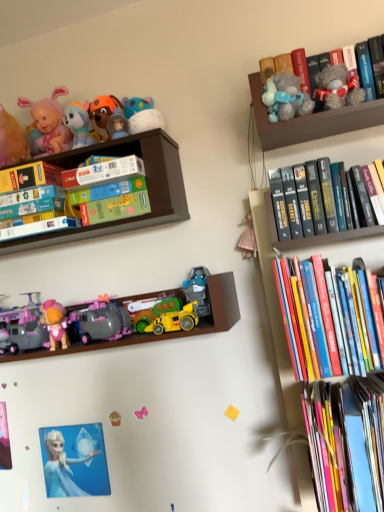
Image resolution: width=384 pixels, height=512 pixels. What are the coordinates of `hardcover book at right, the second book in the top-to-bottom sequence` in the screenshot? It's located at (330, 319).

What is the approximate width of hardcover book at right, the second book positioned from the bottom?

hardcover book at right, the second book positioned from the bottom, is 9.79 inches wide.

Image resolution: width=384 pixels, height=512 pixels. What do you see at coordinates (328, 212) in the screenshot?
I see `hardcover books at upper right, the 1th book from the top` at bounding box center [328, 212].

In order to face hardcover book at right, the third book positioned from the top, should I rotate leftwards or rightwards?

It's best to rotate right around 20.837 degrees.

Describe the element at coordinates (103, 173) in the screenshot. The width and height of the screenshot is (384, 512). I see `white matte paperback book at upper center, the 1th paperback book from the right` at that location.

Describe the element at coordinates (78, 124) in the screenshot. This screenshot has width=384, height=512. I see `plush toy at upper left, which is the third toy from top to bottom` at that location.

What do you see at coordinates (99, 321) in the screenshot? Image resolution: width=384 pixels, height=512 pixels. I see `matte plastic toy car at center, which appears as the fifth toy when viewed from the right` at bounding box center [99, 321].

I want to click on hardcover book at right, the second book positioned from the bottom, so click(x=330, y=319).

Does plush toy at upper left, which is counted as the fifth toy, starting from the bottom, have a lesser height compared to pink fabric bow at center, the second toy from the bottom?

In fact, plush toy at upper left, which is counted as the fifth toy, starting from the bottom, may be taller than pink fabric bow at center, the second toy from the bottom.

Is plush toy at upper left, placed as the second toy when sorted from left to right, facing towards pink fabric bow at center, the second toy from the bottom?

No, plush toy at upper left, placed as the second toy when sorted from left to right, is not turned towards pink fabric bow at center, the second toy from the bottom.

Which toy is the 1st one when counting from the front of the pink fabric bow at center, the 6th toy when ordered from top to bottom? Please provide its 2D coordinates.

[(78, 124)]

From a real-world perspective, is plush toy at upper left, placed as the second toy when sorted from left to right, above or below pink fabric bow at center, the 6th toy when ordered from top to bottom?

plush toy at upper left, placed as the second toy when sorted from left to right, is above pink fabric bow at center, the 6th toy when ordered from top to bottom.

Based on their positions, is fluffy gray teddy bear at upper right, the 1th toy viewed from the right, located to the left or right of pink fabric bow at center, the second toy from the bottom?

Based on their positions, fluffy gray teddy bear at upper right, the 1th toy viewed from the right, is located to the right of pink fabric bow at center, the second toy from the bottom.

From a real-world perspective, is fluffy gray teddy bear at upper right, the 7th toy positioned from the bottom, on pink fabric bow at center, the 5th toy from the left?

Yes, from a real-world perspective, fluffy gray teddy bear at upper right, the 7th toy positioned from the bottom, is above pink fabric bow at center, the 5th toy from the left.

Considering their positions, is fluffy gray teddy bear at upper right, which is counted as the seventh toy, starting from the left, located in front of or behind pink fabric bow at center, the 6th toy when ordered from top to bottom?

Visually, fluffy gray teddy bear at upper right, which is counted as the seventh toy, starting from the left, is located in front of pink fabric bow at center, the 6th toy when ordered from top to bottom.

In the scene shown: Is pink fabric bow at center, the 5th toy from the left, at the back of fluffy gray teddy bear at upper right, the 1th toy viewed from the right?

No, pink fabric bow at center, the 5th toy from the left, is not at the back of fluffy gray teddy bear at upper right, the 1th toy viewed from the right.

Considering the points (113, 421) and (101, 339), which point is in front, point (113, 421) or point (101, 339)?

The point (101, 339) is in front.

Locate an element on the screen. This screenshot has width=384, height=512. the 2nd toy above the pink fabric doll at lower left, arranged as the fourth toy when viewed from the left (from a real-world perspective) is located at coordinates (99, 321).

What's the angular difference between pink fabric doll at lower left, which appears as the fourth toy when viewed from the right, and matte plastic toy car at center, acting as the 4th toy starting from the bottom,'s facing directions?

0.116 degrees.

Considering the positions of objects pink fabric doll at lower left, which is the first toy in bottom-to-top order, and matte plastic toy car at center, which is the fourth toy from top to bottom, in the image provided, who is more to the right, pink fabric doll at lower left, which is the first toy in bottom-to-top order, or matte plastic toy car at center, which is the fourth toy from top to bottom,?

pink fabric doll at lower left, which is the first toy in bottom-to-top order.

Is white matte paperback book at upper center, placed as the second paperback book when sorted from left to right, to the left of yellow plastic toy car at center from the viewer's perspective?

Correct, you'll find white matte paperback book at upper center, placed as the second paperback book when sorted from left to right, to the left of yellow plastic toy car at center.

In terms of width, does white matte paperback book at upper center, the second paperback book in the bottom-to-top sequence, look wider or thinner when compared to yellow plastic toy car at center?

Considering their sizes, white matte paperback book at upper center, the second paperback book in the bottom-to-top sequence, looks broader than yellow plastic toy car at center.

Which of these two, white matte paperback book at upper center, the second paperback book in the bottom-to-top sequence, or yellow plastic toy car at center, stands shorter?

With less height is white matte paperback book at upper center, the second paperback book in the bottom-to-top sequence.

Image resolution: width=384 pixels, height=512 pixels. Find the location of `toy car below the white matte paperback book at upper center, the second paperback book in the bottom-to-top sequence (from a real-world perspective)`. toy car below the white matte paperback book at upper center, the second paperback book in the bottom-to-top sequence (from a real-world perspective) is located at coordinates (167, 317).

Are hardcover book at right, the second book in the top-to-bottom sequence, and hardcover book at right, which is the first book from bottom to top, making contact?

No, hardcover book at right, the second book in the top-to-bottom sequence, is not beside hardcover book at right, which is the first book from bottom to top.

Image resolution: width=384 pixels, height=512 pixels. I want to click on the 1st book above the hardcover book at right, the third book positioned from the top (from a real-world perspective), so click(x=330, y=319).

From a real-world perspective, is hardcover book at right, the second book positioned from the bottom, over hardcover book at right, which is the first book from bottom to top?

Yes, from a real-world perspective, hardcover book at right, the second book positioned from the bottom, is over hardcover book at right, which is the first book from bottom to top

Which of these two, hardcover book at right, which is the first book from bottom to top, or plush toy at upper left, which is the third toy from top to bottom, is thinner?

plush toy at upper left, which is the third toy from top to bottom, is thinner.

Does hardcover book at right, which is the first book from bottom to top, appear on the right side of plush toy at upper left, which is the sixth toy from right to left?

Yes.

Is hardcover book at right, the third book positioned from the top, oriented away from plush toy at upper left, which is the sixth toy from right to left?

hardcover book at right, the third book positioned from the top, does not have its back to plush toy at upper left, which is the sixth toy from right to left.

Considering the relative sizes of pink fabric doll at lower left, which is the first toy in bottom-to-top order, and yellow plastic toy car at center in the image provided, is pink fabric doll at lower left, which is the first toy in bottom-to-top order, bigger than yellow plastic toy car at center?

Actually, pink fabric doll at lower left, which is the first toy in bottom-to-top order, might be smaller than yellow plastic toy car at center.

From the image's perspective, which one is positioned lower, pink fabric doll at lower left, the 7th toy positioned from the top, or yellow plastic toy car at center?

pink fabric doll at lower left, the 7th toy positioned from the top.

Is pink fabric doll at lower left, arranged as the fourth toy when viewed from the left, not near yellow plastic toy car at center?

No, pink fabric doll at lower left, arranged as the fourth toy when viewed from the left, is not far from yellow plastic toy car at center.

From a real-world perspective, count 5th toys downward from the plush toy at upper left, which is the sixth toy from right to left, and point to it. Please provide its 2D coordinates.

[(141, 413)]

From the fluffy gray teddy bear at upper right, the 1th toy viewed from the right, count the 2nd toy to the left and point to it. Please provide its 2D coordinates.

[(141, 413)]

Looking at the image, which one is located further to hardcover book at right, the third book positioned from the top, matte purple plastic toy car at lower left, placed as the 1th toy when sorted from left to right, or pink fabric bow at center, the 5th toy from the left?

matte purple plastic toy car at lower left, placed as the 1th toy when sorted from left to right, lies further to hardcover book at right, the third book positioned from the top, than the other object.

From the image, which object appears to be nearer to hardcover book at right, the second book in the top-to-bottom sequence, matte plastic toy car at center, which appears as the fifth toy when viewed from the right, or hardcover book at left, which ranks as the first paperback book in bottom-to-top order?

Among the two, matte plastic toy car at center, which appears as the fifth toy when viewed from the right, is located nearer to hardcover book at right, the second book in the top-to-bottom sequence.

Looking at the image, which one is located closer to hardcover books at upper right, the 1th book from the top, fluffy gray teddy bear at upper right, which is counted as the seventh toy, starting from the left, or matte plastic toy car at center, which is the fourth toy from top to bottom?

Among the two, fluffy gray teddy bear at upper right, which is counted as the seventh toy, starting from the left, is located nearer to hardcover books at upper right, the 1th book from the top.

Considering their positions, is hardcover books at upper right, which ranks as the 3th book in bottom-to-top order, positioned closer to yellow plastic toy car at center than matte plastic toy car at center, which appears as the third toy when viewed from the left?

matte plastic toy car at center, which appears as the third toy when viewed from the left, lies closer to yellow plastic toy car at center than the other object.

Based on their spatial positions, is pink fabric doll at lower left, which is the first toy in bottom-to-top order, or fluffy gray teddy bear at upper right, the 1th toy viewed from the right, further from pink fabric bow at center, the 6th toy when ordered from top to bottom?

fluffy gray teddy bear at upper right, the 1th toy viewed from the right, is further to pink fabric bow at center, the 6th toy when ordered from top to bottom.

When comparing their distances from pink fabric bow at center, the 5th toy from the left, does matte plastic toy car at center, acting as the 4th toy starting from the bottom, or yellow plastic toy car at center seem closer?

The object closer to pink fabric bow at center, the 5th toy from the left, is matte plastic toy car at center, acting as the 4th toy starting from the bottom.

Which object lies nearer to the anchor point hardcover book at left, the 2th paperback book when ordered from right to left, white glossy elsa at lower left or hardcover book at right, which is the first book from bottom to top?

white glossy elsa at lower left is closer to hardcover book at left, the 2th paperback book when ordered from right to left.

When comparing their distances from matte plastic toy car at center, which appears as the fifth toy when viewed from the right, does plastic toys at center, acting as the first shelf starting from the bottom, or hardcover books at upper right, the 1th book from the top, seem further?

hardcover books at upper right, the 1th book from the top, is further to matte plastic toy car at center, which appears as the fifth toy when viewed from the right.

The image size is (384, 512). I want to click on book between plastic toys at center, acting as the first shelf starting from the bottom, and hardcover books at upper right, which ranks as the 3th book in bottom-to-top order, in the horizontal direction, so click(330, 319).

Where is `book between fluffy gray teddy bear at upper right, which is counted as the seventh toy, starting from the left, and hardcover book at right, the second book in the top-to-bottom sequence, in the vertical direction`? The image size is (384, 512). book between fluffy gray teddy bear at upper right, which is counted as the seventh toy, starting from the left, and hardcover book at right, the second book in the top-to-bottom sequence, in the vertical direction is located at coordinates (328, 212).

At what (x,y) coordinates should I click in order to perform the action: click on book between hardcover books at upper right, the 1th book from the top, and hardcover book at right, the third book positioned from the top, from top to bottom. Please return your answer as a coordinate pair (x, y). Looking at the image, I should click on (330, 319).

Image resolution: width=384 pixels, height=512 pixels. I want to click on shelf between white matte paperback book at upper center, placed as the second paperback book when sorted from left to right, and yellow plastic toy car at center vertically, so click(147, 188).